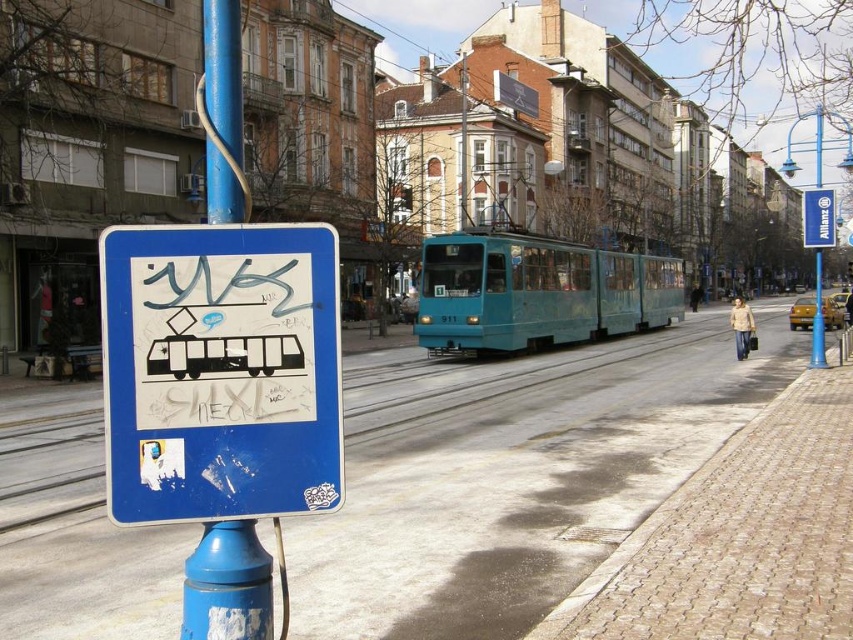
You are standing at the center of the image and want to walk to the brick pavement at lower right. Which direction should you move relative to your current position?

To reach the brick pavement at lower right from the center of the image, you should move towards the lower right direction since its 2D location is at point (515, 474).

You are a delivery person who needs to read the tram number on the light blue tram in the middle ground. However, you are currently standing behind the blue plastic sign at left and the blue plastic sign at upper center. Which sign is blocking your view more because it is larger?

The blue plastic sign at upper center is larger than the blue plastic sign at left, so it is blocking your view more.